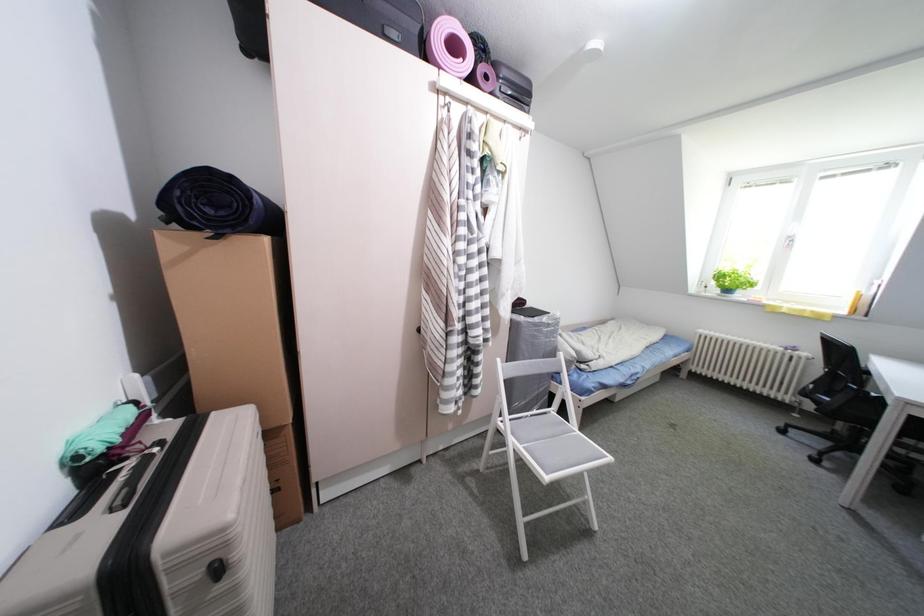
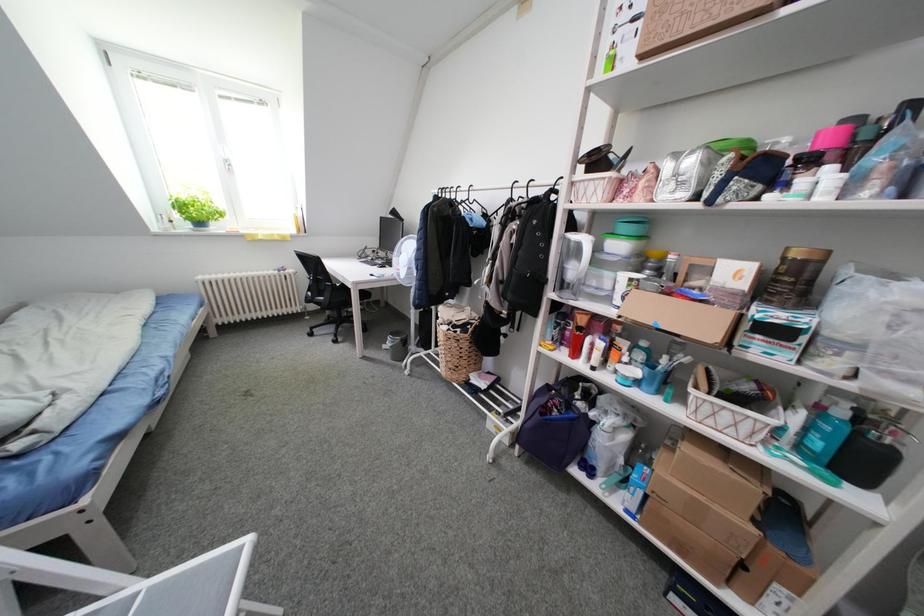
The images are taken continuously from a first-person perspective. In which direction is your viewpoint rotating?

The camera's rotation is toward right-down.